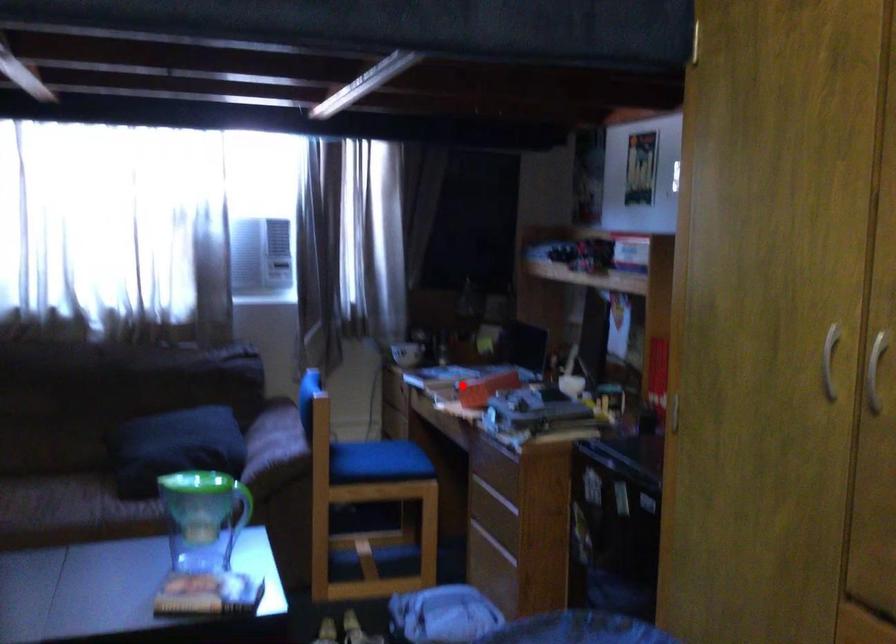
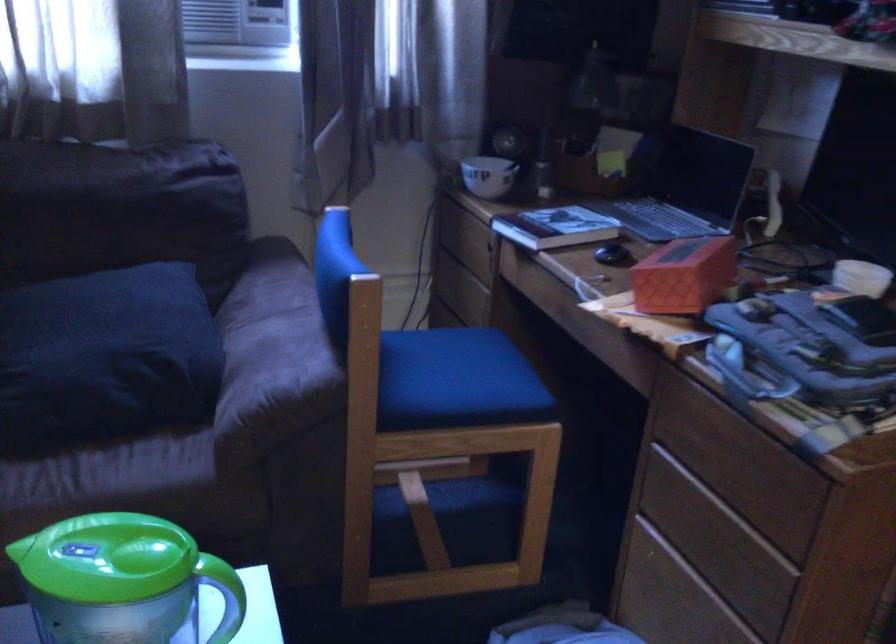
Question: I am providing you with two images of the same scene from different viewpoints. Given a red point in image1, look at the same physical point in image2. Is it:

Choices:
 (A) Closer to the viewpoint
 (B) Farther from the viewpoint

Answer: (A)